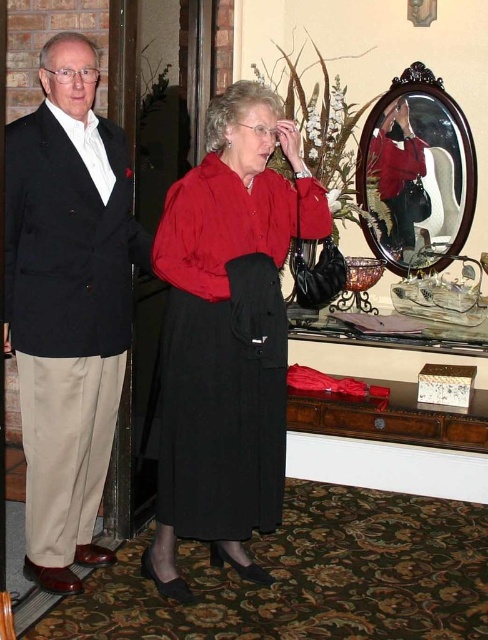
From the picture: Who is positioned more to the left, matte black suit at left or wooden oval mirror at upper center?

matte black suit at left

Who is positioned more to the right, matte black suit at left or wooden oval mirror at upper center?

wooden oval mirror at upper center

Between point (61, 396) and point (442, 109), which one is positioned in front?

Positioned in front is point (61, 396).

Locate an element on the screen. The width and height of the screenshot is (488, 640). matte black suit at left is located at coordinates (67, 304).

Does velvet red dress at center have a lesser width compared to wooden oval mirror at upper center?

In fact, velvet red dress at center might be wider than wooden oval mirror at upper center.

From the picture: Measure the distance from velvet red dress at center to wooden oval mirror at upper center.

They are 1.13 meters apart.

Does point (200, 307) come in front of point (425, 122)?

Yes, it is.

Where is `velvet red dress at center`? The image size is (488, 640). velvet red dress at center is located at coordinates (225, 348).

Which is more to the left, matte black suit at left or matte black blazer at left?

matte black blazer at left

Which of these two, matte black suit at left or matte black blazer at left, stands taller?

With more height is matte black suit at left.

Where is `matte black suit at left`? Image resolution: width=488 pixels, height=640 pixels. matte black suit at left is located at coordinates (67, 304).

This screenshot has width=488, height=640. What are the coordinates of `matte black suit at left` in the screenshot? It's located at (67, 304).